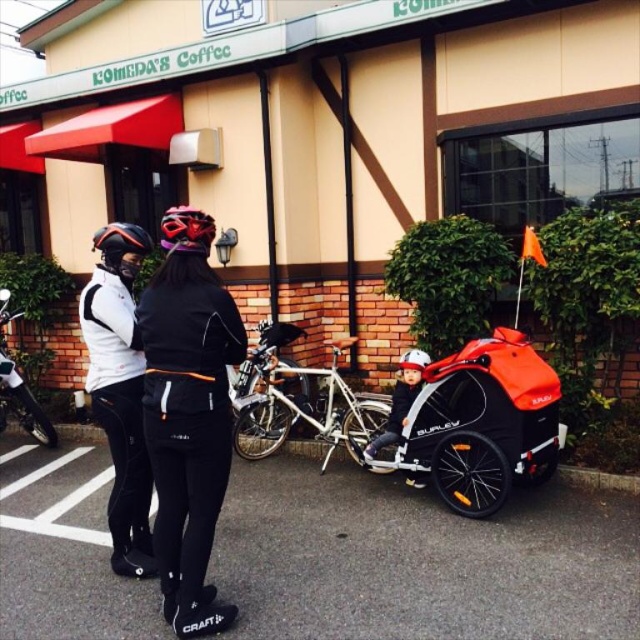
Question: Does white matte jacket at center appear under matte black helmet at upper left?

Choices:
 (A) yes
 (B) no

Answer: (A)

Question: Is silver metallic bicycle at center positioned before shiny silver bicycle at center?

Choices:
 (A) yes
 (B) no

Answer: (A)

Question: Which of the following is the closest to the observer?

Choices:
 (A) (252, 424)
 (B) (216, 365)

Answer: (B)

Question: Among these objects, which one is nearest to the camera?

Choices:
 (A) shiny silver bicycle at center
 (B) matte black helmet at upper left
 (C) shiny red helmet at center
 (D) black matte jacket at center

Answer: (D)

Question: Which object is positioned closest to the shiny silver bicycle at center?

Choices:
 (A) shiny red helmet at center
 (B) matte black helmet at upper left
 (C) white matte jacket at center
 (D) black matte jacket at center

Answer: (C)

Question: From the image, what is the correct spatial relationship of silver metallic bicycle at center in relation to shiny red helmet at center?

Choices:
 (A) below
 (B) above

Answer: (A)